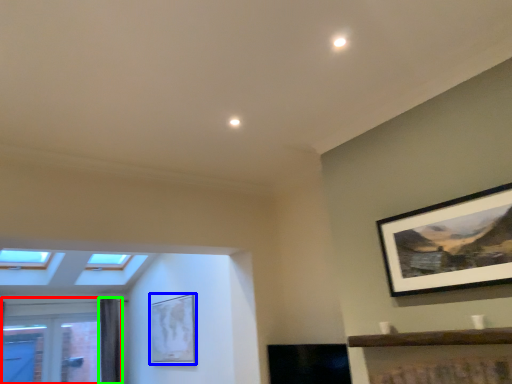
Question: Based on their relative distances, which object is nearer to window (highlighted by a red box)? Choose from picture frame (highlighted by a blue box) and curtain (highlighted by a green box).

Choices:
 (A) picture frame
 (B) curtain

Answer: (B)